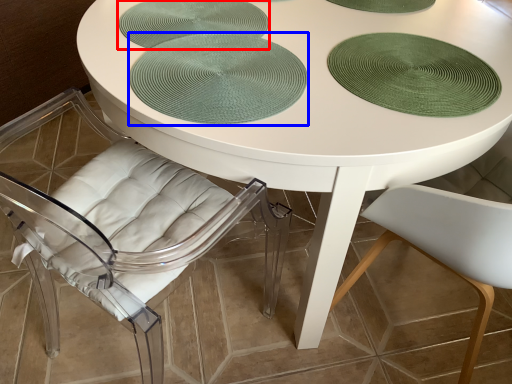
Question: Among these objects, which one is farthest to the camera, glass plate (highlighted by a red box) or poker table (highlighted by a blue box)?

Choices:
 (A) glass plate
 (B) poker table

Answer: (A)